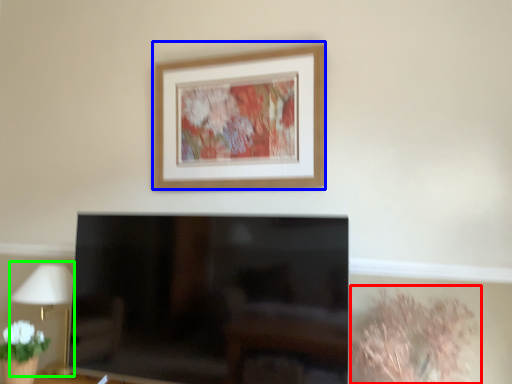
Question: Which object is positioned farthest from plant (highlighted by a red box)? Select from picture frame (highlighted by a blue box) and table lamp (highlighted by a green box).

Choices:
 (A) picture frame
 (B) table lamp

Answer: (B)